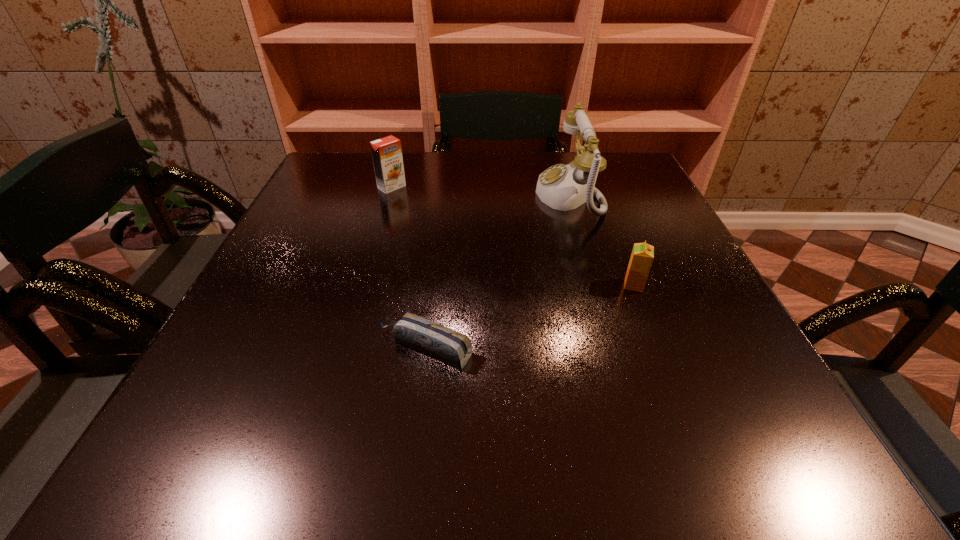
Image resolution: width=960 pixels, height=540 pixels. I want to click on vacant region that satisfies the following two spatial constraints: 1. on the dial of the right orange juice; 2. on the left side of the tallest object, so click(595, 285).